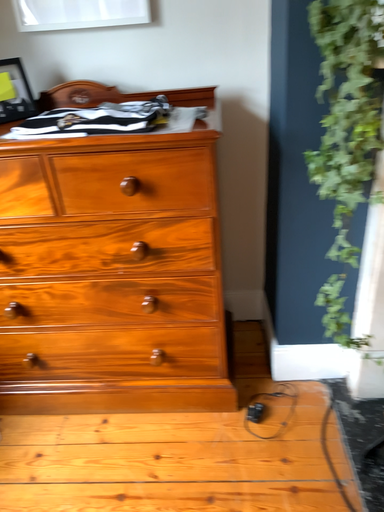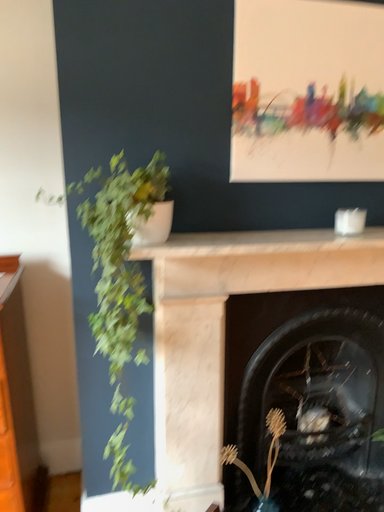
Question: Which way did the camera rotate in the video?

Choices:
 (A) rotated left
 (B) rotated right

Answer: (B)